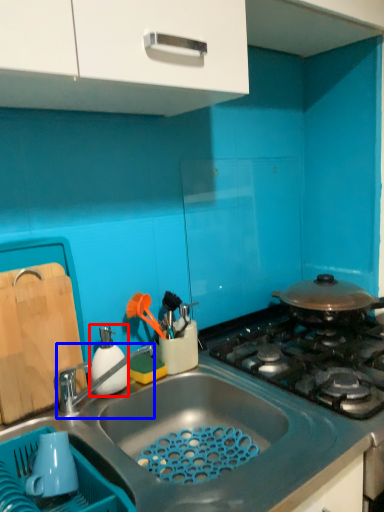
Question: Which object appears farthest to the camera in this image, appliance (highlighted by a red box) or tap (highlighted by a blue box)?

Choices:
 (A) appliance
 (B) tap

Answer: (A)